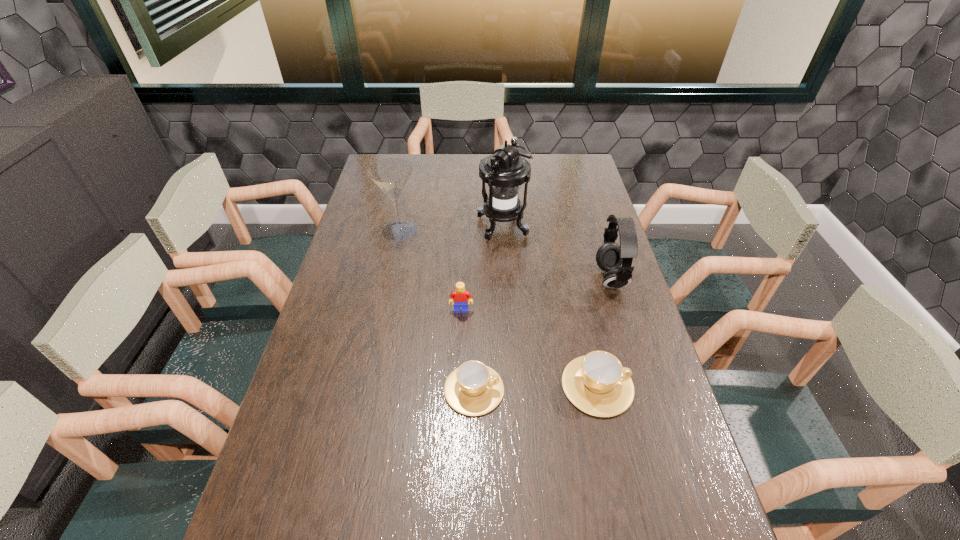
Identify the location of free region at the far edge of the desktop. (455, 154).

Image resolution: width=960 pixels, height=540 pixels. I want to click on vacant space at the near edge of the desktop, so click(x=340, y=501).

The image size is (960, 540). In order to click on vacant point at the left edge in this screenshot , I will do `click(356, 266)`.

Locate an element on the screen. This screenshot has width=960, height=540. blank space at the right edge is located at coordinates (665, 385).

The width and height of the screenshot is (960, 540). I want to click on free space at the far right corner, so click(562, 179).

Find the location of `free point between the shorter cup and the lantern`. free point between the shorter cup and the lantern is located at coordinates (489, 308).

The height and width of the screenshot is (540, 960). In order to click on blank region between the fourth farthest object and the leftmost object in this screenshot , I will do `click(430, 271)`.

Locate an element on the screen. Image resolution: width=960 pixels, height=540 pixels. free space between the earphone and the flute glass is located at coordinates (505, 254).

The height and width of the screenshot is (540, 960). What are the coordinates of `vacant point located between the right cup and the shortest object` in the screenshot? It's located at (536, 388).

Locate an element on the screen. Image resolution: width=960 pixels, height=540 pixels. unoccupied position between the shorter cup and the taller cup is located at coordinates (536, 388).